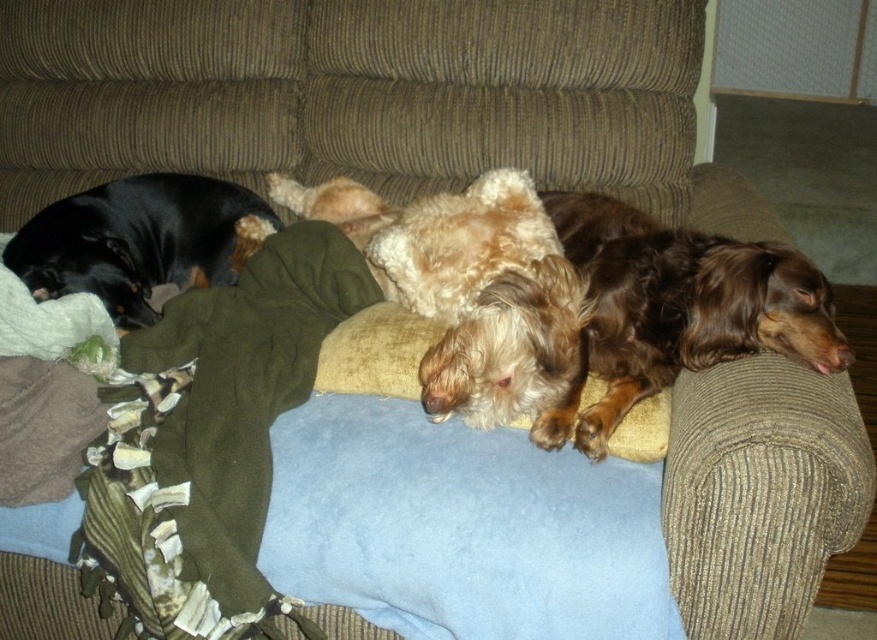
Between green fleece blanket at lower left and brown silky dog at right, which one is positioned lower?

green fleece blanket at lower left is lower down.

Is green fleece blanket at lower left shorter than brown silky dog at right?

Incorrect, green fleece blanket at lower left's height does not fall short of brown silky dog at right's.

Is point (162, 593) positioned behind point (637, 397)?

No, (162, 593) is closer to viewer.

You are a GUI agent. You are given a task and a screenshot of the screen. Output one action in this format:
    pyautogui.click(x=<x>, y=<y>)
    Task: Click on the green fleece blanket at lower left
    
    Given the screenshot: What is the action you would take?
    pyautogui.click(x=209, y=442)

Between brown silky dog at right and black smooth coat at left, which one appears on the right side from the viewer's perspective?

From the viewer's perspective, brown silky dog at right appears more on the right side.

Does brown silky dog at right have a smaller size compared to black smooth coat at left?

No.

Who is more distant from viewer, [633,397] or [136,300]?

The point [136,300] is more distant.

The image size is (877, 640). I want to click on brown silky dog at right, so click(676, 308).

Can you confirm if green fleece blanket at lower left is positioned below black smooth coat at left?

Yes.

Does point (148, 428) come farther from viewer compared to point (191, 192)?

No, it is in front of (191, 192).

Does point (265, 304) lie behind point (29, 256)?

No, (265, 304) is in front of (29, 256).

You are a GUI agent. You are given a task and a screenshot of the screen. Output one action in this format:
    pyautogui.click(x=<x>, y=<y>)
    Task: Click on the green fleece blanket at lower left
    
    Given the screenshot: What is the action you would take?
    pyautogui.click(x=209, y=442)